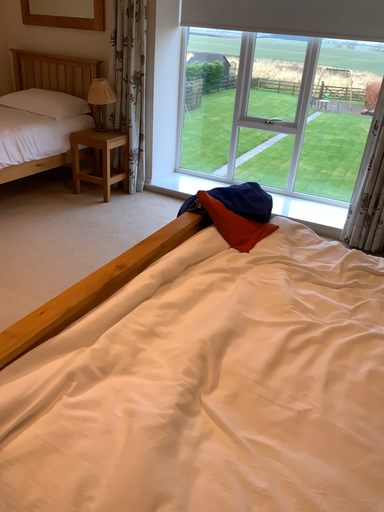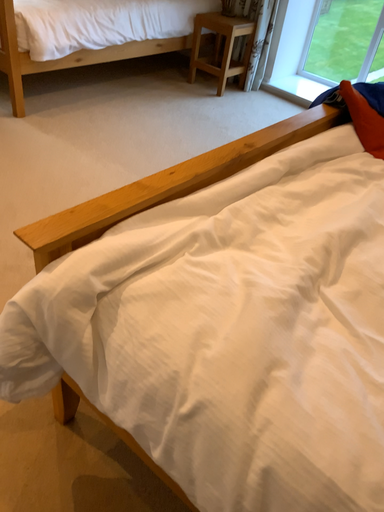
Question: How did the camera likely rotate when shooting the video?

Choices:
 (A) rotated left
 (B) rotated right

Answer: (A)